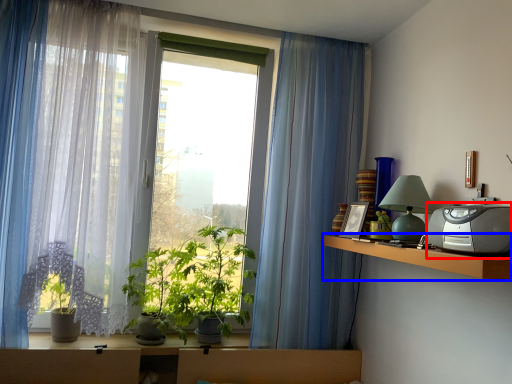
Question: Among these objects, which one is farthest to the camera, appliance (highlighted by a red box) or shelf (highlighted by a blue box)?

Choices:
 (A) appliance
 (B) shelf

Answer: (B)